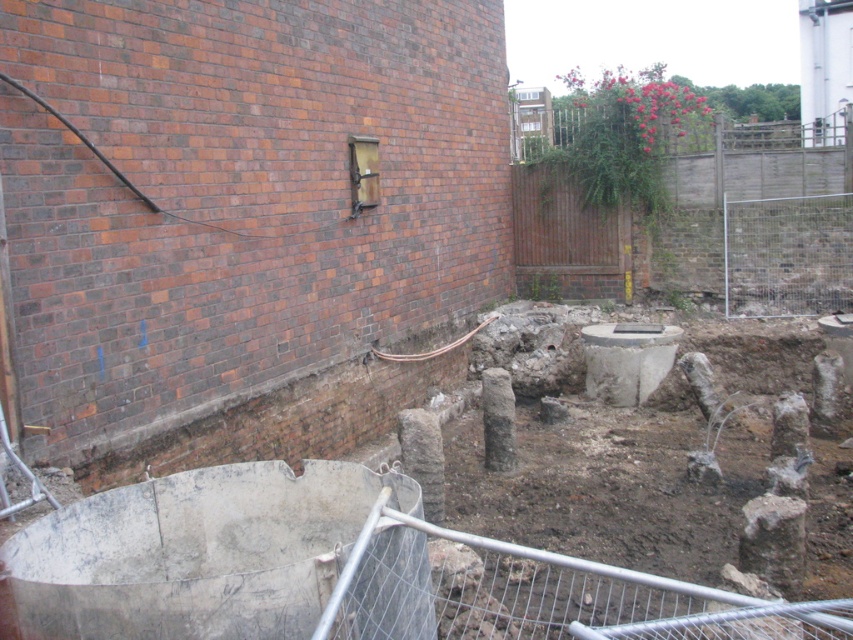
Question: Is brown wooden fence at upper right closer to the viewer compared to metal wire mesh at lower center?

Choices:
 (A) yes
 (B) no

Answer: (B)

Question: Is brown wooden fence at upper right bigger than metal wire mesh at lower center?

Choices:
 (A) yes
 (B) no

Answer: (A)

Question: Which point is farther to the camera?

Choices:
 (A) brown wooden fence at upper right
 (B) metal wire mesh at lower center
 (C) smooth concrete hole at center

Answer: (A)

Question: Which of the following is the farthest from the observer?

Choices:
 (A) brown wooden fence at upper right
 (B) metal wire mesh at lower center
 (C) smooth concrete hole at center

Answer: (A)

Question: Observing the image, what is the correct spatial positioning of brown wooden fence at upper right in reference to metal wire mesh at lower center?

Choices:
 (A) left
 (B) right

Answer: (B)

Question: Which point is closer to the camera taking this photo?

Choices:
 (A) (688, 170)
 (B) (514, 576)
 (C) (628, 326)

Answer: (B)